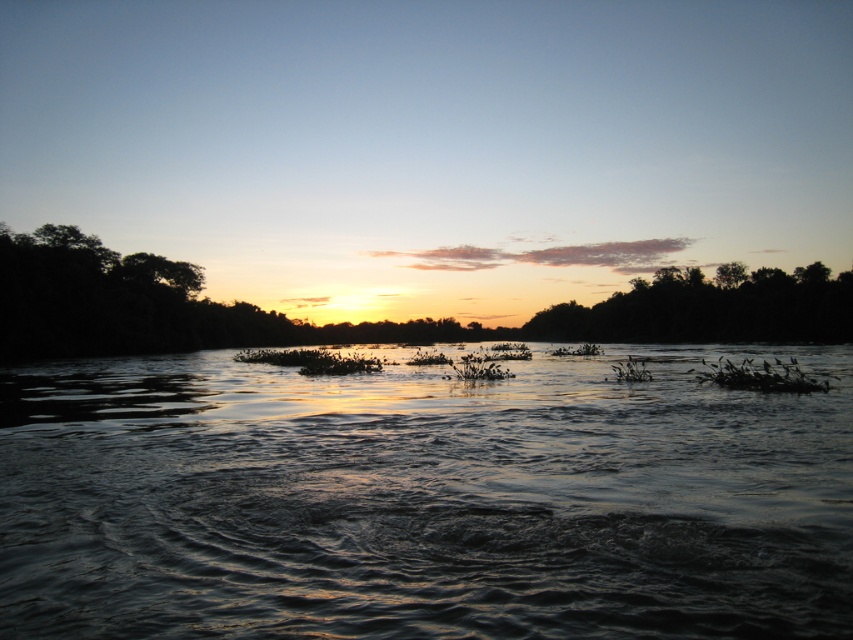
Question: Does dark reflective water at center appear on the right side of silhouette/textured trees at right?

Choices:
 (A) yes
 (B) no

Answer: (B)

Question: Is dark reflective water at center smaller than silhouette/textured trees at right?

Choices:
 (A) yes
 (B) no

Answer: (A)

Question: Among these points, which one is farthest from the camera?

Choices:
 (A) (614, 326)
 (B) (439, 550)

Answer: (A)

Question: Does dark reflective water at center have a lesser width compared to silhouette/textured trees at right?

Choices:
 (A) yes
 (B) no

Answer: (B)

Question: Which point appears closest to the camera in this image?

Choices:
 (A) [846, 385]
 (B) [596, 305]

Answer: (A)